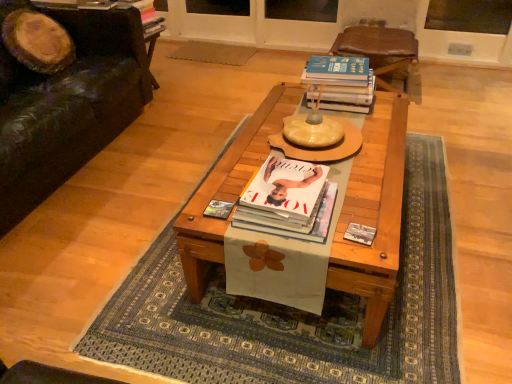
At what (x,y) coordinates should I click in order to perform the action: click on blank space to the left of white glossy book at center, which appears as the first book when viewed from the left. Please return your answer as a coordinate pair (x, y). Looking at the image, I should click on (216, 201).